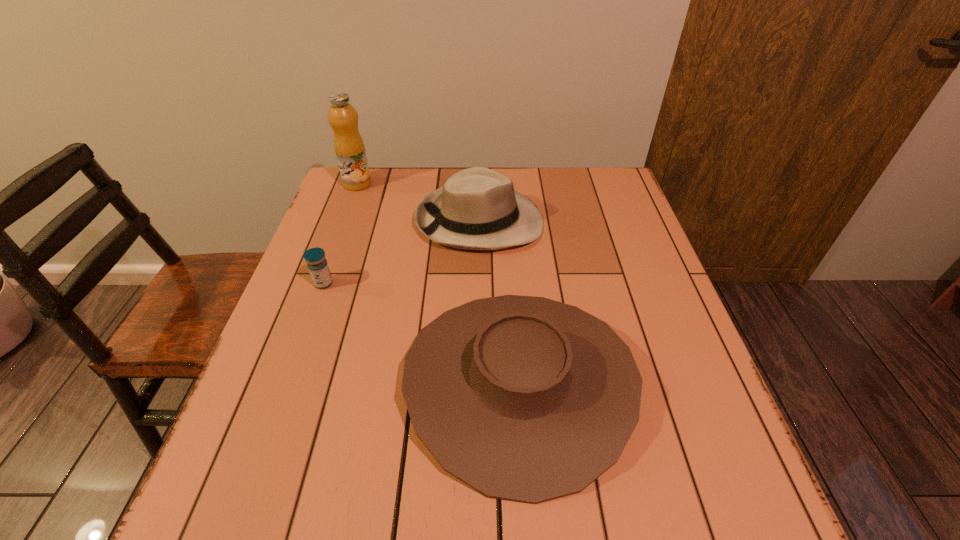
Find the location of a particular element. fruit juice is located at coordinates (349, 147).

Where is `the second tallest object`? the second tallest object is located at coordinates [478, 209].

Find the location of a particular element. The height and width of the screenshot is (540, 960). the nearest object is located at coordinates (527, 399).

The image size is (960, 540). I want to click on cowboy hat, so click(x=527, y=399).

Identify the location of the shortest object. The width and height of the screenshot is (960, 540). (317, 264).

Identify the location of the third farthest object. The image size is (960, 540). (317, 264).

The height and width of the screenshot is (540, 960). In order to click on vacant area situated on the front label of the fruit juice in this screenshot , I will do `click(489, 184)`.

At what (x,y) coordinates should I click in order to perform the action: click on vacant space situated 0.220m on the front-facing side of the fedora. Please return your answer as a coordinate pair (x, y). This screenshot has width=960, height=540. Looking at the image, I should click on (621, 221).

Locate an element on the screen. This screenshot has height=540, width=960. vacant area situated on the back of the second shortest object is located at coordinates (509, 246).

Find the location of a particular element. This screenshot has width=960, height=540. vacant space located on the right of the medicine is located at coordinates (412, 284).